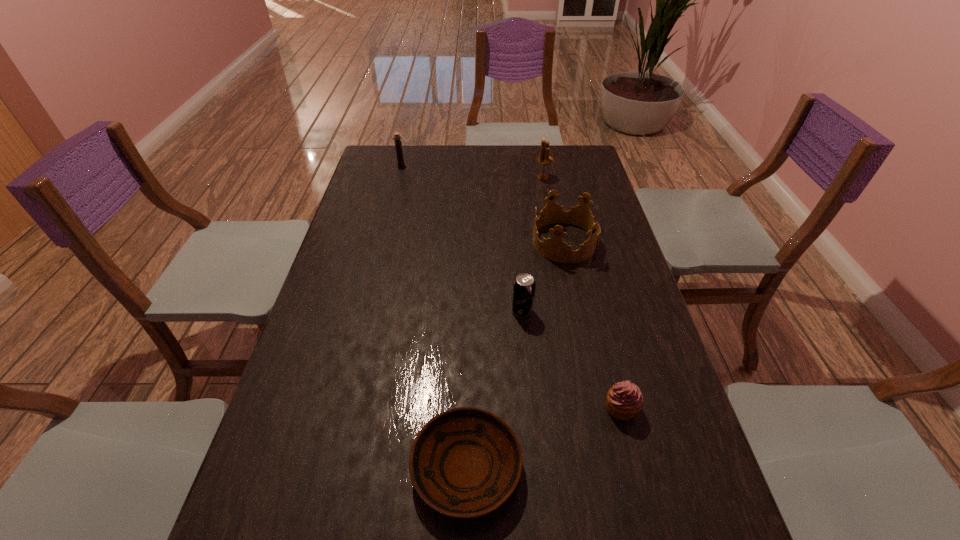
Locate an element on the screen. The width and height of the screenshot is (960, 540). free point between the nearer candle holder and the shortest object is located at coordinates tap(505, 322).

This screenshot has height=540, width=960. I want to click on vacant area between the shortest object and the right candle holder, so click(505, 322).

Locate an element on the screen. The width and height of the screenshot is (960, 540). empty space that is in between the third object from left to right and the shortest object is located at coordinates (494, 389).

This screenshot has height=540, width=960. I want to click on vacant area between the cupcake and the nearer candle holder, so click(582, 293).

You are a GUI agent. You are given a task and a screenshot of the screen. Output one action in this format:
    pyautogui.click(x=<x>, y=<y>)
    Task: Click on the object that ranks as the fourth closest to the left candle holder
    The height and width of the screenshot is (540, 960).
    Given the screenshot: What is the action you would take?
    pyautogui.click(x=465, y=462)

Identify which object is the fourth nearest to the shorter candle holder. Please provide its 2D coordinates. Your answer should be formatted as a tuple, i.e. [(x, y)], where the tuple contains the x and y coordinates of a point satisfying the conditions above.

[(465, 462)]

This screenshot has width=960, height=540. What are the coordinates of `vacant area that satisfies the following two spatial constraints: 1. on the back side of the soda can; 2. on the left side of the plate` in the screenshot? It's located at (469, 311).